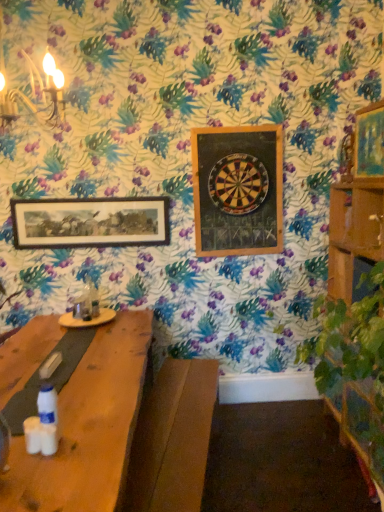
You are a GUI agent. You are given a task and a screenshot of the screen. Output one action in this format:
    pyautogui.click(x=<x>, y=<y>)
    Task: Click on the blank space situated above wooden framed artwork at upper left, which appears as the 3th picture frame when viewed from the front (from a real-world perspective)
    Image resolution: width=384 pixels, height=512 pixels.
    Given the screenshot: What is the action you would take?
    [91, 198]